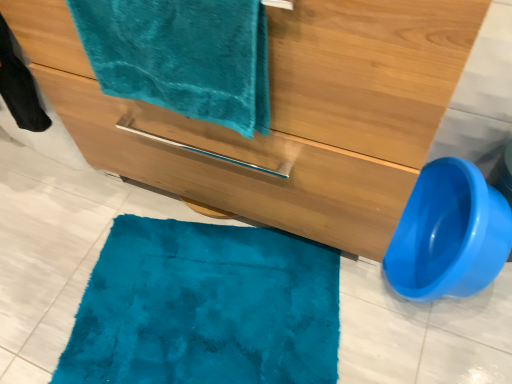
Question: From the image's perspective, is blue plastic toilet bowl at lower right located above or below matte wood bathroom cabinet at center?

Choices:
 (A) below
 (B) above

Answer: (A)

Question: Considering the positions of blue plastic toilet bowl at lower right and matte wood bathroom cabinet at center in the image, is blue plastic toilet bowl at lower right bigger or smaller than matte wood bathroom cabinet at center?

Choices:
 (A) small
 (B) big

Answer: (A)

Question: Which is farther from the matte wood bathroom cabinet at center?

Choices:
 (A) teal plush towel at upper left
 (B) blue plastic toilet bowl at lower right

Answer: (B)

Question: Estimate the real-world distances between objects in this image. Which object is farther from the teal plush towel at upper left?

Choices:
 (A) matte wood bathroom cabinet at center
 (B) blue plastic toilet bowl at lower right

Answer: (B)